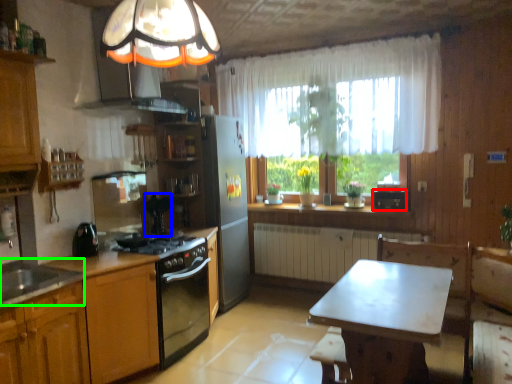
Question: Considering the real-world distances, which object is closest to appliance (highlighted by a red box)? appliance (highlighted by a blue box) or sink (highlighted by a green box).

Choices:
 (A) appliance
 (B) sink

Answer: (A)